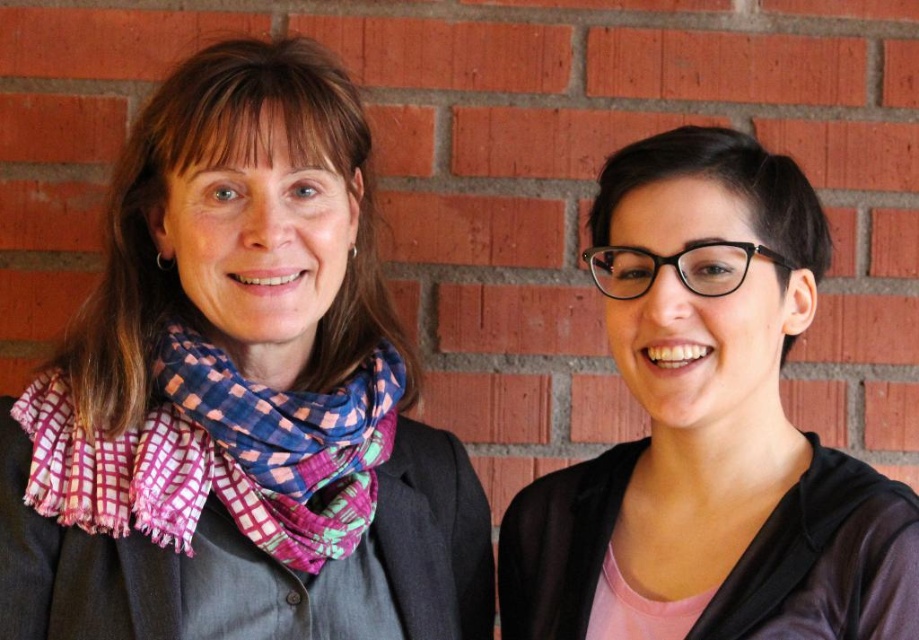
Question: Considering the relative positions of multicolored scarf at left and multicolored woven scarf at left in the image provided, where is multicolored scarf at left located with respect to multicolored woven scarf at left?

Choices:
 (A) below
 (B) above

Answer: (B)

Question: Observing the image, what is the correct spatial positioning of multicolored scarf at left in reference to multicolored woven scarf at left?

Choices:
 (A) above
 (B) below

Answer: (A)

Question: Which point is farther from the camera taking this photo?

Choices:
 (A) (177, 488)
 (B) (730, 140)
 (C) (75, 499)

Answer: (B)

Question: Which object is closer to the camera taking this photo?

Choices:
 (A) pink matte scarf at upper right
 (B) multicolored scarf at left
 (C) multicolored woven scarf at left

Answer: (A)

Question: Which point is farther to the camera?

Choices:
 (A) multicolored scarf at left
 (B) multicolored woven scarf at left

Answer: (B)

Question: Observing the image, what is the correct spatial positioning of multicolored scarf at left in reference to pink matte scarf at upper right?

Choices:
 (A) right
 (B) left

Answer: (B)